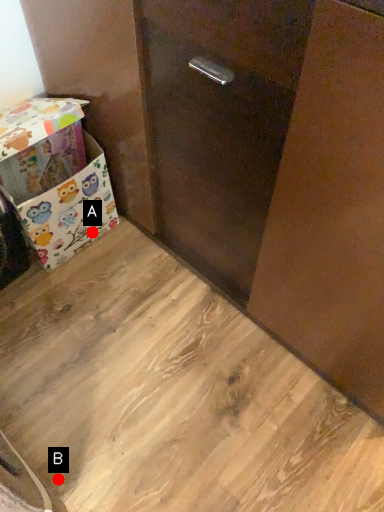
Question: Two points are circled on the image, labeled by A and B beside each circle. Which point appears farthest from the camera in this image?

Choices:
 (A) A is further
 (B) B is further

Answer: (A)